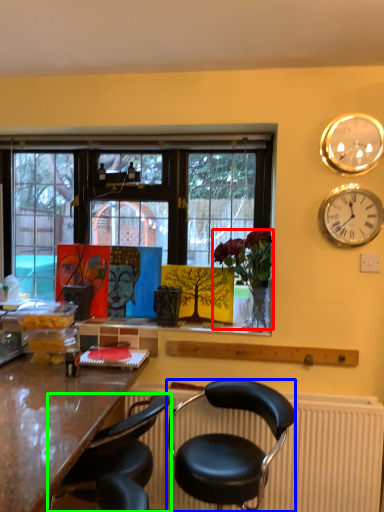
Question: Considering the real-world distances, which object is farthest from houseplant (highlighted by a red box)? chair (highlighted by a blue box) or chair (highlighted by a green box)?

Choices:
 (A) chair
 (B) chair

Answer: (B)